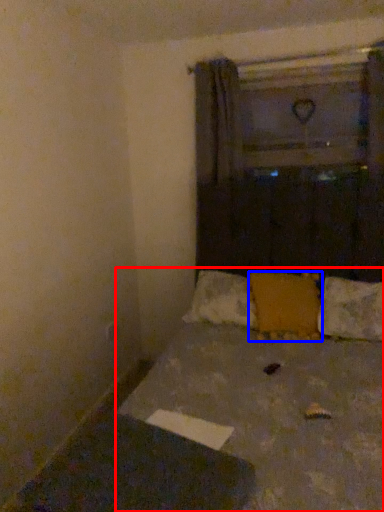
Question: Which of the following is the farthest to the observer, bed (highlighted by a red box) or pillow (highlighted by a blue box)?

Choices:
 (A) bed
 (B) pillow

Answer: (B)